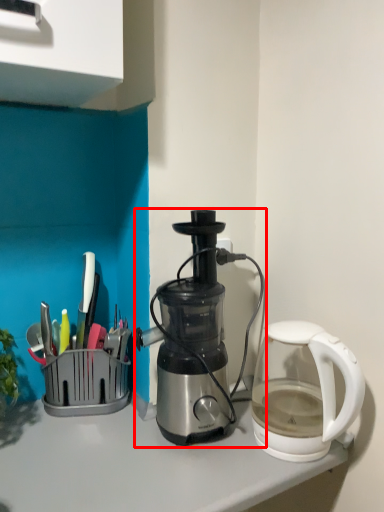
Question: From the image's perspective, what is the correct spatial relationship of coffee maker (annotated by the red box) in relation to kettle?

Choices:
 (A) below
 (B) above

Answer: (B)